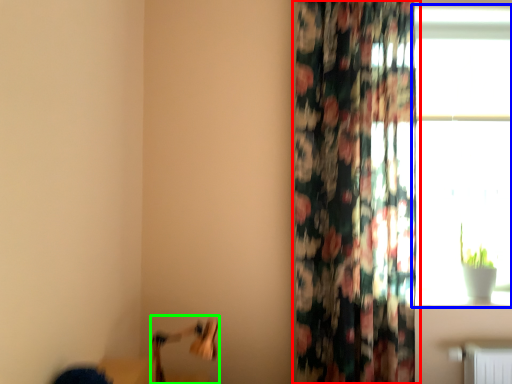
Question: Which is farther away from curtain (highlighted by a red box)? window (highlighted by a blue box) or swivel chair (highlighted by a green box)?

Choices:
 (A) window
 (B) swivel chair

Answer: (B)